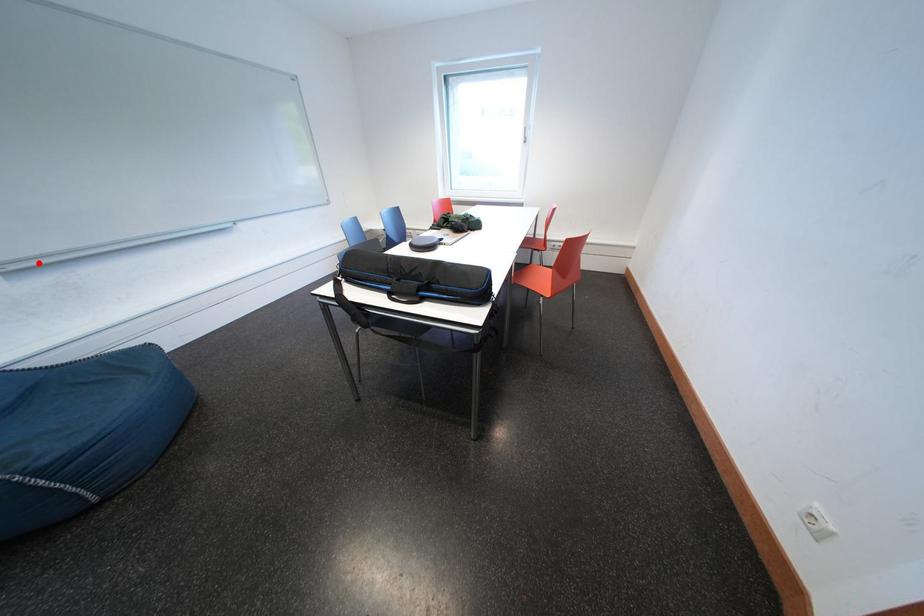
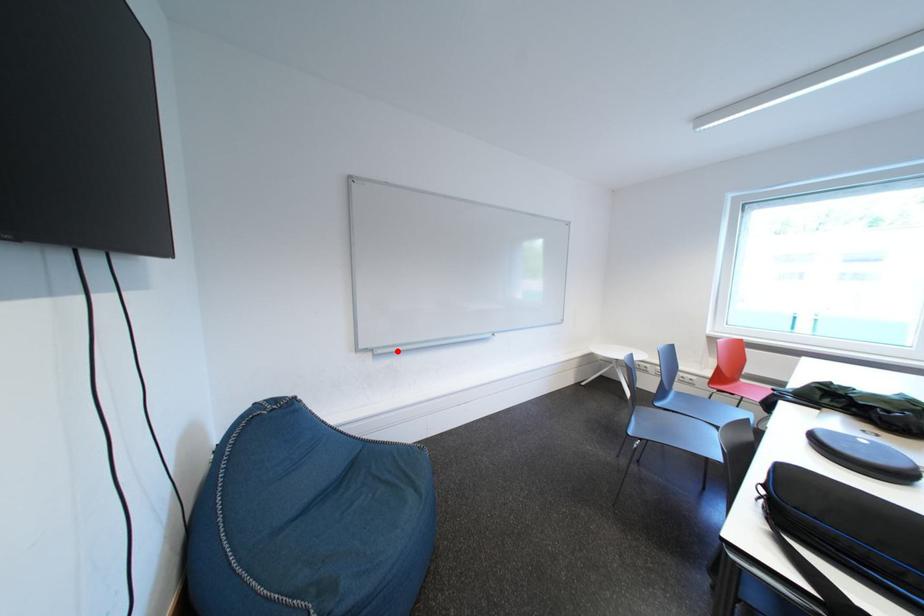
I am providing you with two images of the same scene from different viewpoints. A red point is marked on the first image and another point is marked on the second image. Does the point marked in image1 correspond to the same location as the one in image2?

Yes